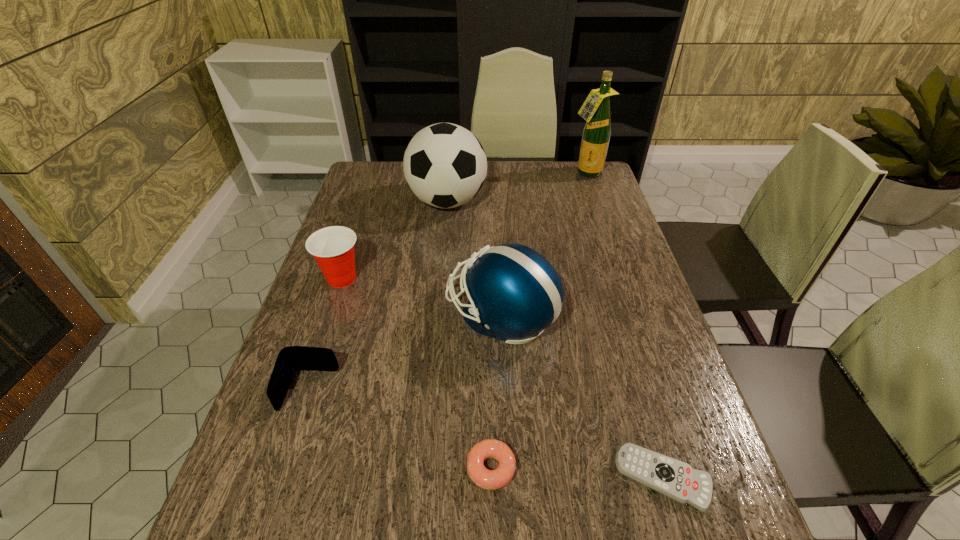
Locate which object is the closest to the second farthest object. Please provide its 2D coordinates. Your answer should be formatted as a tuple, i.e. [(x, y)], where the tuple contains the x and y coordinates of a point satisfying the conditions above.

[(332, 247)]

Image resolution: width=960 pixels, height=540 pixels. I want to click on free location that satisfies the following two spatial constraints: 1. on the outer surface of the fifth tallest object; 2. on the left side of the shortest object, so click(x=281, y=478).